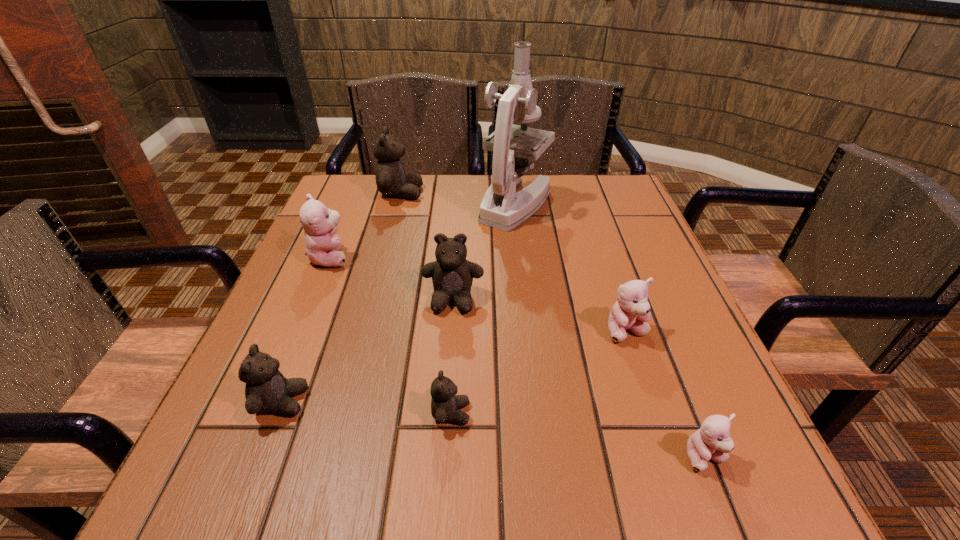
Identify which pink teddy bear is the second closest to the third smallest brown teddy bear. Please provide its 2D coordinates. Your answer should be formatted as a tuple, i.e. [(x, y)], where the tuple contains the x and y coordinates of a point satisfying the conditions above.

[(631, 312)]

Where is `vacant space that satisfies the following two spatial constraints: 1. on the front side of the tallest object; 2. on the face of the smallest brown teddy bear`? The image size is (960, 540). vacant space that satisfies the following two spatial constraints: 1. on the front side of the tallest object; 2. on the face of the smallest brown teddy bear is located at coordinates (540, 413).

You are a GUI agent. You are given a task and a screenshot of the screen. Output one action in this format:
    pyautogui.click(x=<x>, y=<y>)
    Task: Click on the vacant space that satisfies the following two spatial constraints: 1. on the back side of the microscope; 2. on the face of the seventh shortest object
    
    Given the screenshot: What is the action you would take?
    pyautogui.click(x=515, y=193)

Image resolution: width=960 pixels, height=540 pixels. Find the location of `vacant region that satisfies the following two spatial constraints: 1. on the face of the second farthest brown teddy bear; 2. on the face of the third biggest brown teddy bear`. vacant region that satisfies the following two spatial constraints: 1. on the face of the second farthest brown teddy bear; 2. on the face of the third biggest brown teddy bear is located at coordinates (446, 401).